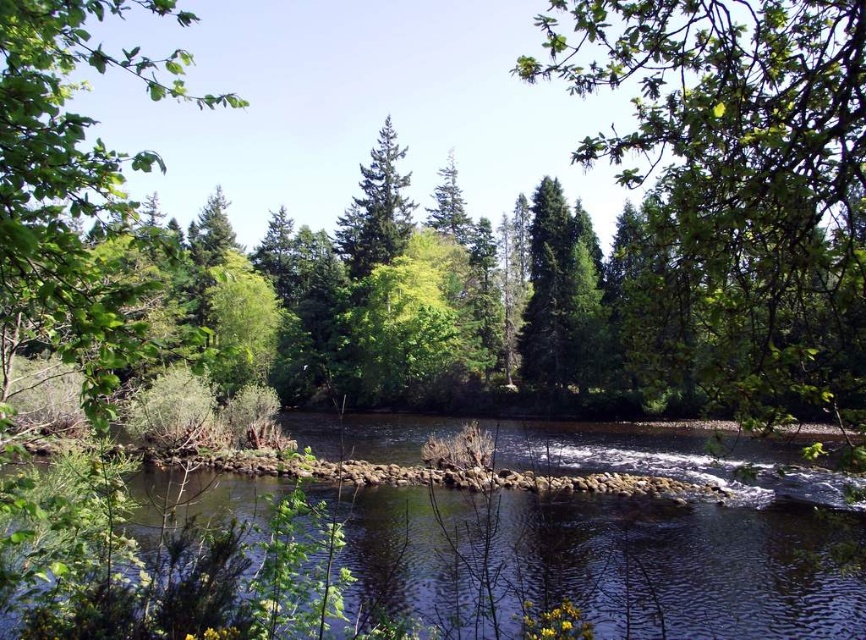
You are a hiker standing at the edge of the scene and want to cross the smooth stone river at center. There is a green leafy tree at upper right blocking your path. Can you walk around it to reach the river?

The green leafy tree at upper right is in front of the smooth stone river at center, so you can walk around the tree to reach the river.

You are standing at the point marked by the coordinates point (612, 561) in the image. What is the nearest object to you?

The nearest object to you is the smooth stone river at center, as the coordinates point (612, 561) directly represent its location.

You are standing on a path that runs parallel to the smooth stone river at center and the green leafy tree at left. Which object is closer to you as you walk along the path?

The smooth stone river at center is closer to you than the green leafy tree at left because it is positioned further away from the viewer.